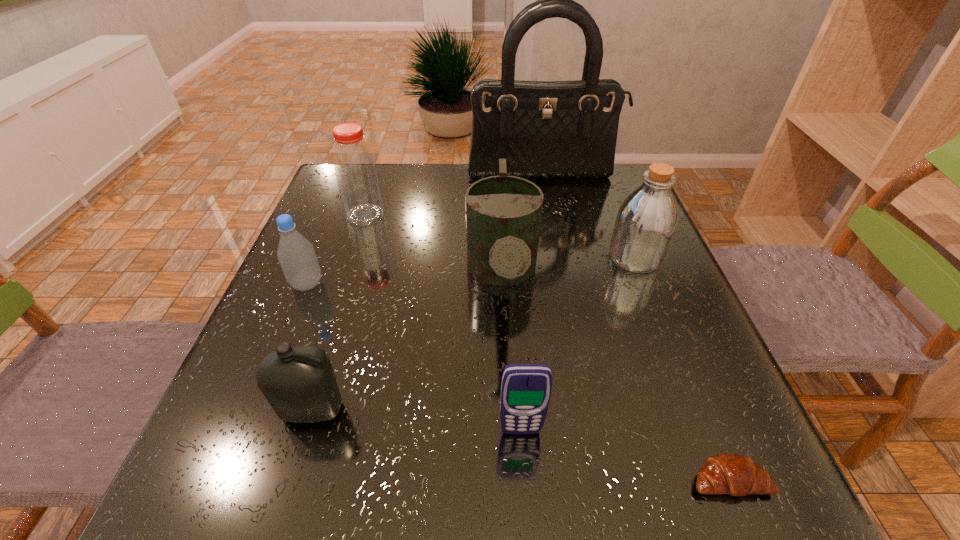
Locate which object ranks third in proximity to the farthest bottle. Please provide its 2D coordinates. Your answer should be formatted as a tuple, i.e. [(x, y)], where the tuple contains the x and y coordinates of a point satisfying the conditions above.

[(544, 129)]

I want to click on bottle that stands as the second closest to the rightmost bottle, so click(x=299, y=383).

In order to click on bottle identified as the closest to the shortest object in this screenshot , I will do `click(646, 221)`.

Locate an element on the screen. vacant space that satisfies the following two spatial constraints: 1. with an open clasp on the front of the farthest object; 2. on the right side of the shortest object is located at coordinates (604, 480).

I want to click on vacant region that satisfies the following two spatial constraints: 1. on the front side of the shortest object; 2. on the left side of the nearest bottle, so click(x=292, y=480).